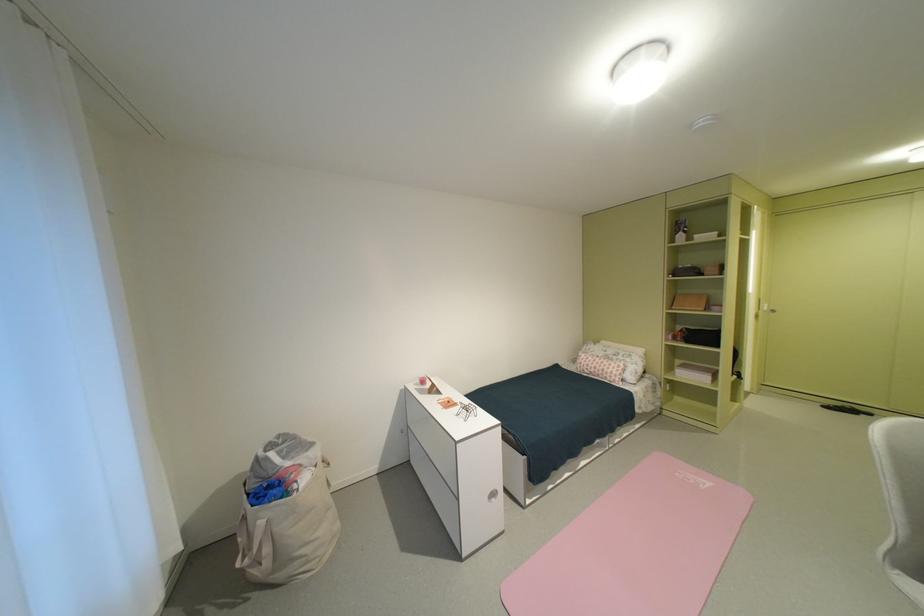
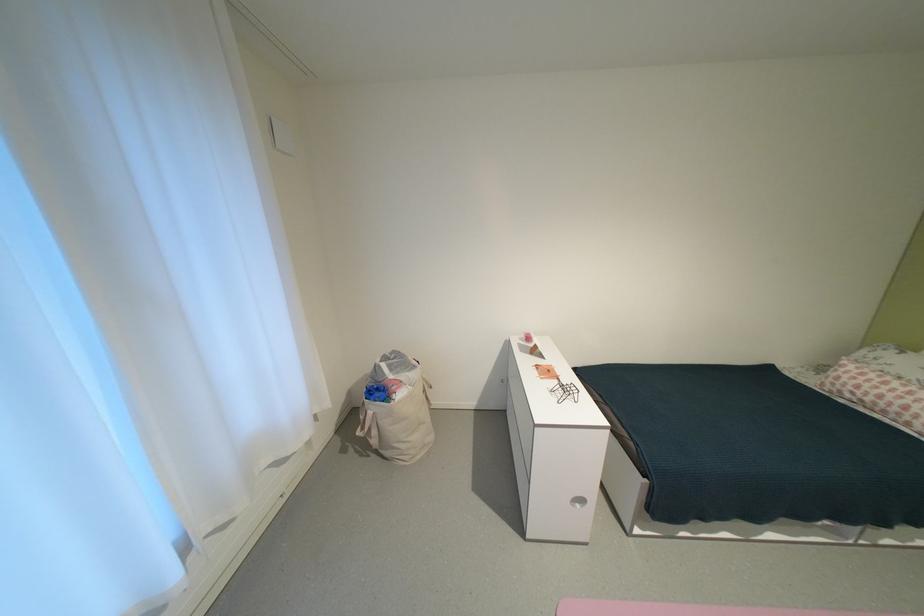
Locate, in the second image, the point that corresponds to point 457,405 in the first image.

(556, 374)